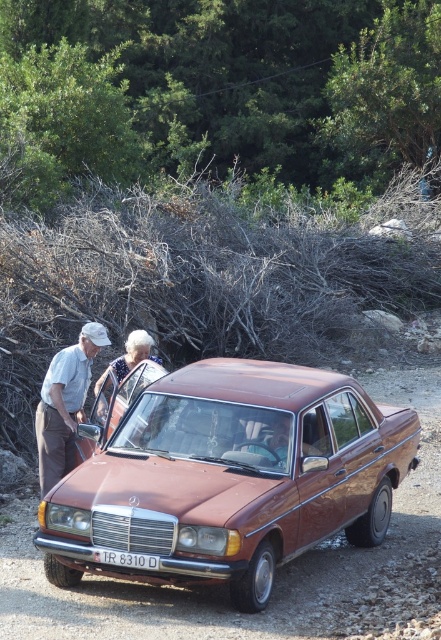
Between light blue cotton shirt at left and white plastic license plate at center, which one appears on the right side from the viewer's perspective?

white plastic license plate at center is more to the right.

Can you confirm if light blue cotton shirt at left is bigger than white plastic license plate at center?

Correct, light blue cotton shirt at left is larger in size than white plastic license plate at center.

Which is behind, point (78, 371) or point (139, 564)?

Positioned behind is point (78, 371).

Image resolution: width=441 pixels, height=640 pixels. Identify the location of light blue cotton shirt at left. (64, 403).

Does rust metallic sedan at center have a greater width compared to white textured dress at center?

Indeed, rust metallic sedan at center has a greater width compared to white textured dress at center.

Which is in front, point (112, 528) or point (104, 374)?

Point (112, 528) is more forward.

The width and height of the screenshot is (441, 640). Find the location of `rust metallic sedan at center`. rust metallic sedan at center is located at coordinates (231, 477).

Is light blue cotton shirt at left taller than white textured dress at center?

Yes, light blue cotton shirt at left is taller than white textured dress at center.

Between point (44, 378) and point (109, 362), which one is positioned behind?

The point (109, 362) is behind.

Find the location of a particular element. This screenshot has height=640, width=441. light blue cotton shirt at left is located at coordinates (64, 403).